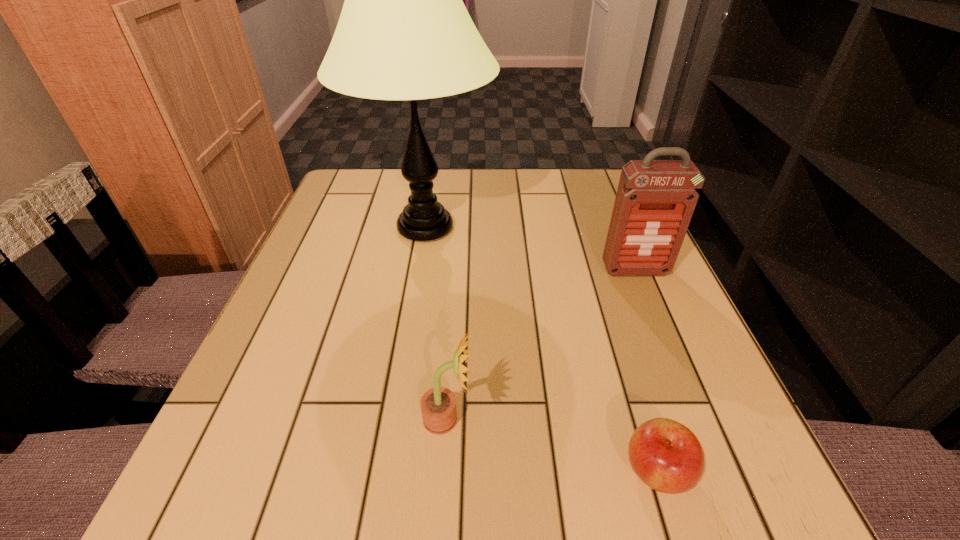
At what (x,y) coordinates should I click in order to perform the action: click on unoccupied area between the first-aid kit and the lamp. Please return your answer as a coordinate pair (x, y). The width and height of the screenshot is (960, 540). Looking at the image, I should click on (530, 249).

This screenshot has height=540, width=960. I want to click on vacant space that's between the apple and the second shortest object, so click(552, 445).

Where is `unoccupied area between the lamp and the third tallest object`? This screenshot has width=960, height=540. unoccupied area between the lamp and the third tallest object is located at coordinates (437, 323).

The image size is (960, 540). Find the location of `free area in between the sunflower and the third shortest object`. free area in between the sunflower and the third shortest object is located at coordinates (541, 345).

The image size is (960, 540). In order to click on blank region between the sunflower and the shortest object in this screenshot , I will do point(552,445).

Identify the location of empty space that is in between the third shortest object and the apple. coord(646,370).

In order to click on vacant area that lies between the first-aid kit and the tallest object in this screenshot , I will do `click(530, 249)`.

At what (x,y) coordinates should I click in order to perform the action: click on free space that is in between the first-aid kit and the tallest object. Please return your answer as a coordinate pair (x, y). This screenshot has height=540, width=960. Looking at the image, I should click on (530, 249).

In order to click on free space between the shortest object and the first-aid kit in this screenshot , I will do `click(646, 370)`.

In order to click on free space between the first-aid kit and the tallest object in this screenshot , I will do `click(530, 249)`.